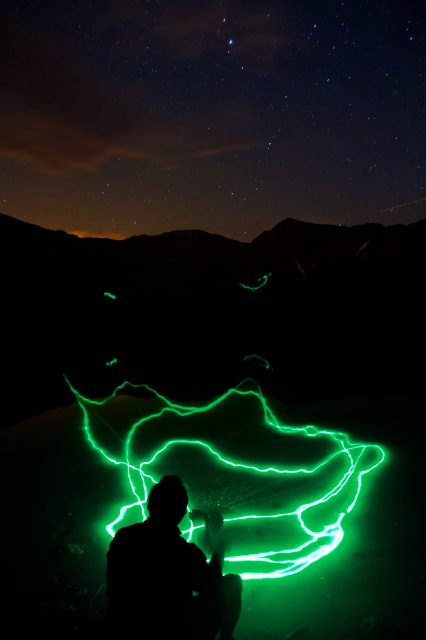
Locate an element on the screen. The width and height of the screenshot is (426, 640). neon green light at center is located at coordinates (244, 476).

Is neon green light at center positioned behind silhouette figure at center?

That is True.

Between point (281, 468) and point (138, 545), which one is positioned in front?

Point (138, 545) is more forward.

Find the location of a particular element. This screenshot has height=640, width=426. neon green light at center is located at coordinates (244, 476).